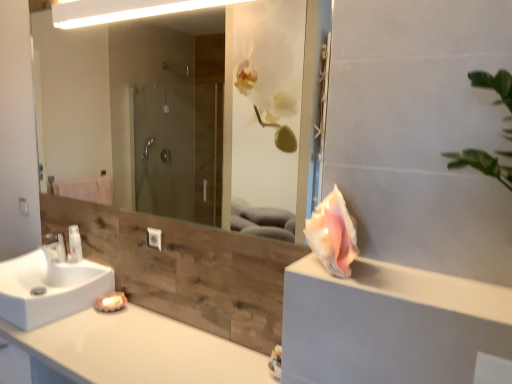
Question: From a real-world perspective, is transparent glass mirror at upper center under pink shell at right?

Choices:
 (A) no
 (B) yes

Answer: (A)

Question: Is transparent glass mirror at upper center not close to pink shell at right?

Choices:
 (A) no
 (B) yes

Answer: (B)

Question: Is transparent glass mirror at upper center turned away from pink shell at right?

Choices:
 (A) no
 (B) yes

Answer: (A)

Question: From the image's perspective, is transparent glass mirror at upper center below pink shell at right?

Choices:
 (A) yes
 (B) no

Answer: (B)

Question: Considering the relative sizes of transparent glass mirror at upper center and pink shell at right in the image provided, is transparent glass mirror at upper center thinner than pink shell at right?

Choices:
 (A) no
 (B) yes

Answer: (B)

Question: Does transparent glass mirror at upper center have a greater height compared to pink shell at right?

Choices:
 (A) no
 (B) yes

Answer: (B)

Question: Is white glossy countertop at lower left thinner than transparent glass mirror at upper center?

Choices:
 (A) no
 (B) yes

Answer: (A)

Question: Is white glossy countertop at lower left turned away from transparent glass mirror at upper center?

Choices:
 (A) yes
 (B) no

Answer: (B)

Question: Is white glossy countertop at lower left further to camera compared to transparent glass mirror at upper center?

Choices:
 (A) yes
 (B) no

Answer: (B)

Question: Is white glossy countertop at lower left placed right next to transparent glass mirror at upper center?

Choices:
 (A) no
 (B) yes

Answer: (A)

Question: Is white glossy countertop at lower left to the right of transparent glass mirror at upper center from the viewer's perspective?

Choices:
 (A) no
 (B) yes

Answer: (A)

Question: Is white glossy countertop at lower left closer to the viewer compared to transparent glass mirror at upper center?

Choices:
 (A) yes
 (B) no

Answer: (A)

Question: From a real-world perspective, is white glossy countertop at lower left on white glossy faucet at lower left?

Choices:
 (A) no
 (B) yes

Answer: (A)